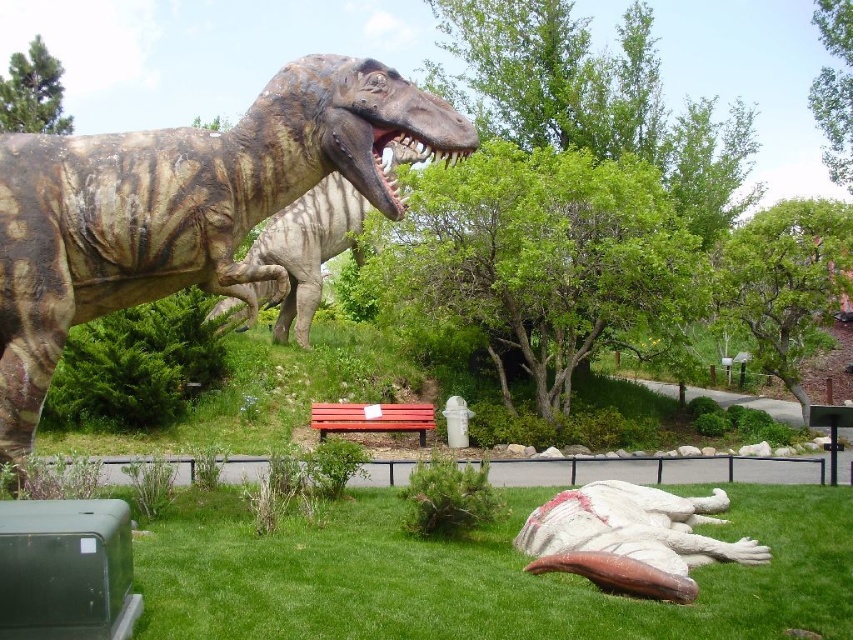
Between camouflage textured dinosaur at upper left and wooden park bench at center, which one appears on the right side from the viewer's perspective?

From the viewer's perspective, wooden park bench at center appears more on the right side.

Measure the distance between point (364, 193) and camera.

Point (364, 193) is 30.81 feet from camera.

Locate an element on the screen. camouflage textured dinosaur at upper left is located at coordinates (183, 205).

Is green grass at lower right to the left of white marble dinosaur at lower right from the viewer's perspective?

Correct, you'll find green grass at lower right to the left of white marble dinosaur at lower right.

Locate an element on the screen. green grass at lower right is located at coordinates (474, 576).

Looking at this image, is white marble dinosaur at lower right to the left of wooden park bench at center from the viewer's perspective?

No, white marble dinosaur at lower right is not to the left of wooden park bench at center.

In the scene shown: Who is more distant from viewer, (701,499) or (326,408)?

The point (326,408) is more distant.

Which is in front, point (625, 556) or point (399, 410)?

Point (625, 556)

You are a GUI agent. You are given a task and a screenshot of the screen. Output one action in this format:
    pyautogui.click(x=<x>, y=<y>)
    Task: Click on the white marble dinosaur at lower right
    
    Given the screenshot: What is the action you would take?
    pyautogui.click(x=630, y=538)